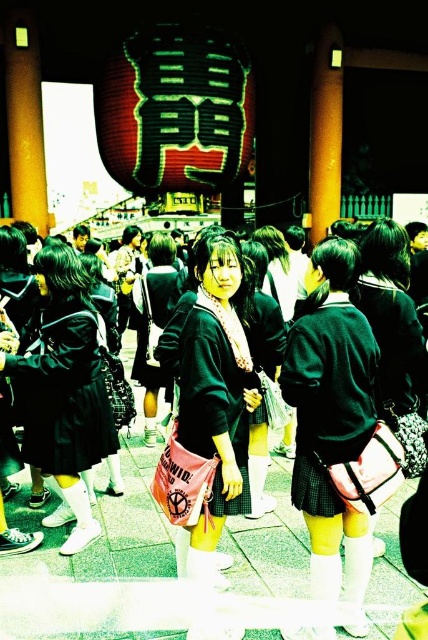
Question: Is matte black sweater at center to the left of shiny red paper lantern at upper center from the viewer's perspective?

Choices:
 (A) no
 (B) yes

Answer: (A)

Question: Which object is positioned farthest from the matte black school uniform at center?

Choices:
 (A) matte black sweater at center
 (B) matte green uniform at center
 (C) green plaid skirt at center
 (D) shiny red paper lantern at upper center

Answer: (D)

Question: Among these points, which one is farthest from the camera?

Choices:
 (A) (374, 355)
 (B) (237, 58)
 (C) (208, 308)
 (D) (332, 282)

Answer: (B)

Question: Considering the relative positions of matte green uniform at center and green plaid skirt at center in the image provided, where is matte green uniform at center located with respect to green plaid skirt at center?

Choices:
 (A) below
 (B) above

Answer: (A)

Question: Is matte black sweater at center closer to camera compared to matte black school uniform at center?

Choices:
 (A) yes
 (B) no

Answer: (A)

Question: Which object is closer to the camera taking this photo?

Choices:
 (A) matte black sweater at center
 (B) matte green uniform at center
 (C) green plaid skirt at center

Answer: (B)